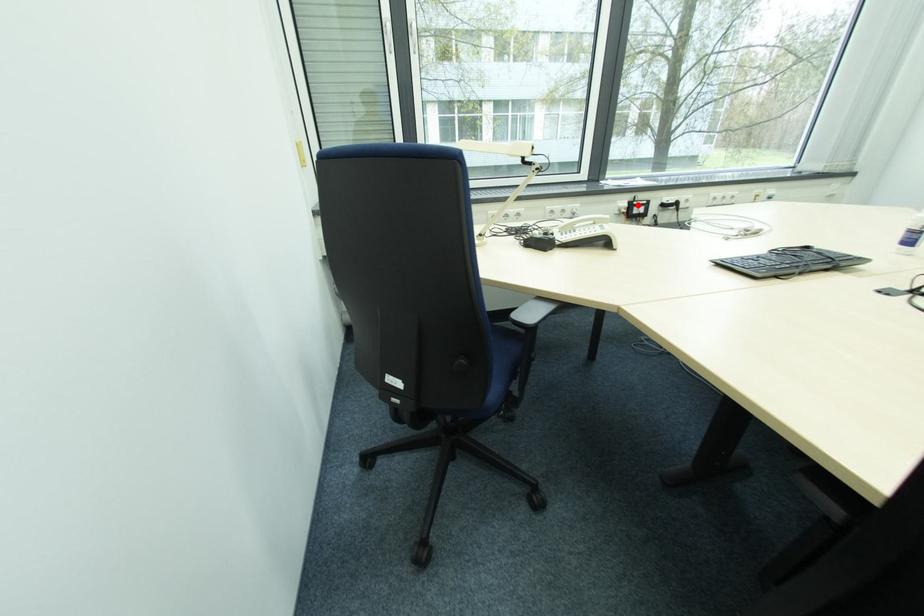
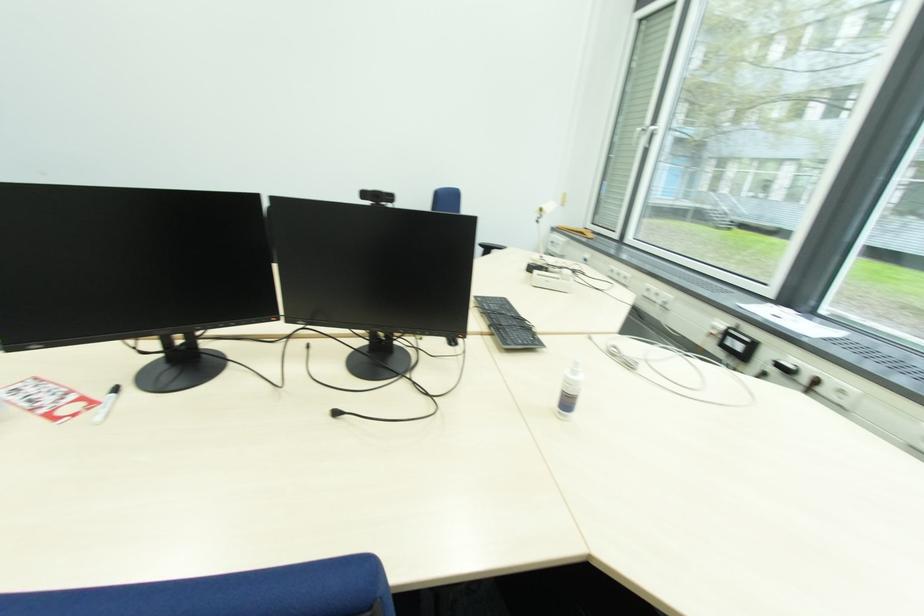
In the second image, find the point that corresponds to the highlighted location in the first image.

(734, 333)